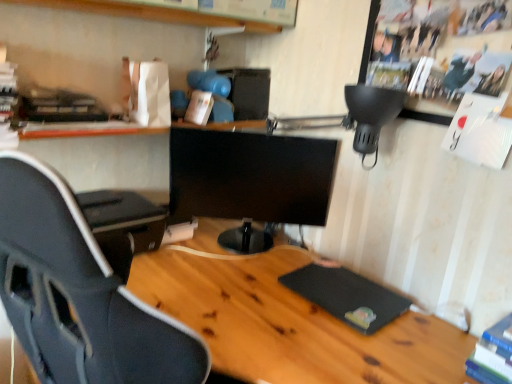
Locate an element on the screen. The width and height of the screenshot is (512, 384). free spot above black rubber mousepad at lower right (from a real-world perspective) is located at coordinates (344, 287).